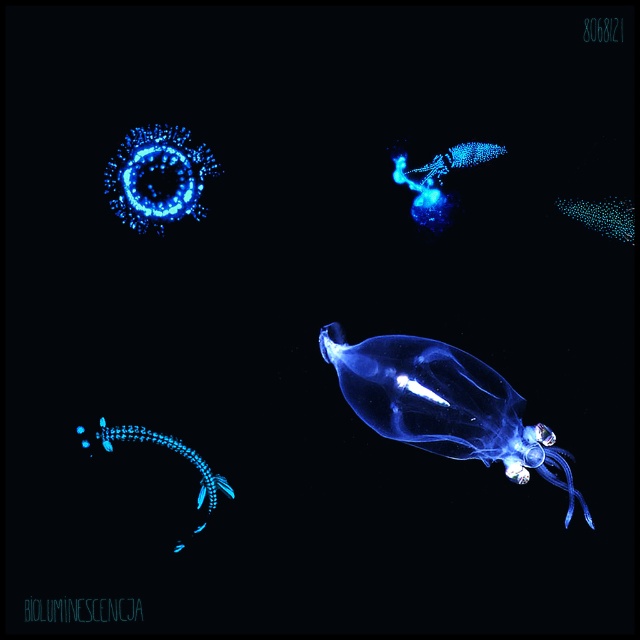
You are a marine biologist observing the bioluminescent marine organisms in the image. Which organism, the transparent gelatinous at center or the glowing blue translucent jellyfish at bottom left, has a greater height?

The transparent gelatinous at center is taller than the glowing blue translucent jellyfish at bottom left according to the description.

You are a marine biologist observing the image. You need to determine the relative positions of the transparent gelatinous at center and the glowing blue translucent jellyfish at bottom left. Which one is located to the right of the other?

The transparent gelatinous at center is positioned on the right side of glowing blue translucent jellyfish at bottom left.